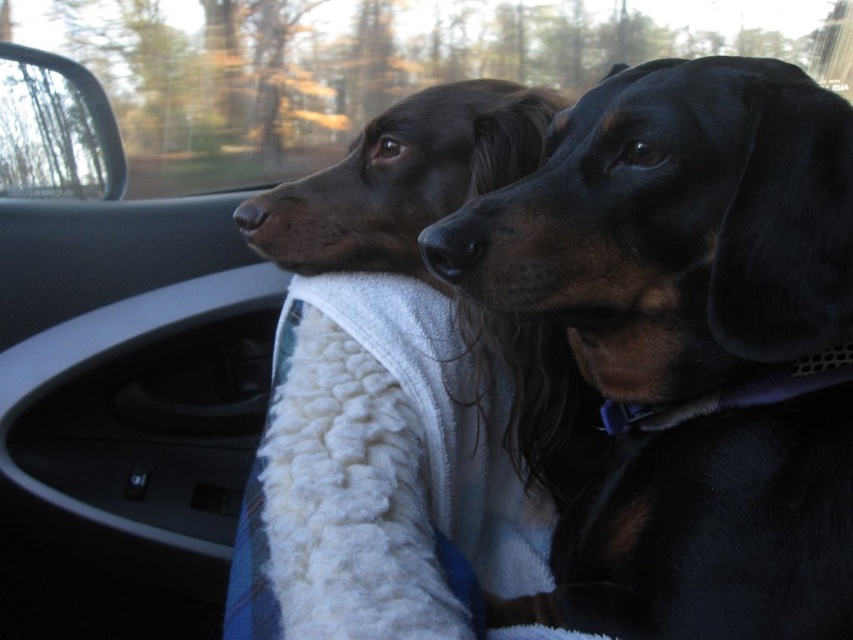
Question: Among these objects, which one is farthest from the camera?

Choices:
 (A) transparent glass car window at upper left
 (B) black smooth dog at center
 (C) shiny brown dog at center

Answer: (A)

Question: Is black smooth dog at center wider than transparent glass car window at upper left?

Choices:
 (A) yes
 (B) no

Answer: (A)

Question: Is black smooth dog at center below shiny brown dog at center?

Choices:
 (A) no
 (B) yes

Answer: (B)

Question: Which of the following is the farthest from the observer?

Choices:
 (A) (393, 164)
 (B) (654, 337)

Answer: (A)

Question: Which point appears closest to the camera in this image?

Choices:
 (A) (361, 224)
 (B) (111, 154)
 (C) (630, 388)

Answer: (C)

Question: Can you confirm if black smooth dog at center is positioned above shiny brown dog at center?

Choices:
 (A) no
 (B) yes

Answer: (A)